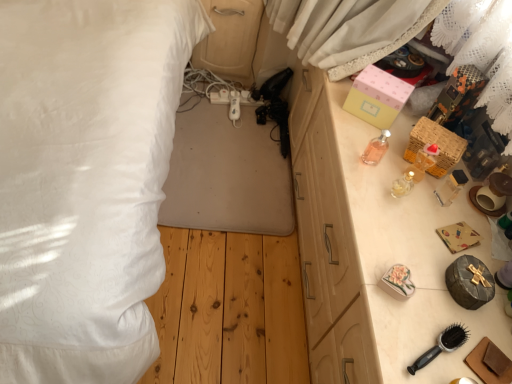
Question: Would you say pink paper box at upper right, which ranks as the 1th box in top-to-bottom order, is outside matte wood dresser at center?

Choices:
 (A) no
 (B) yes

Answer: (B)

Question: From the image's perspective, would you say pink paper box at upper right, which ranks as the 1th box in top-to-bottom order, is positioned over matte wood dresser at center?

Choices:
 (A) no
 (B) yes

Answer: (A)

Question: Does pink paper box at upper right, which is the second box from bottom to top, turn towards matte wood dresser at center?

Choices:
 (A) no
 (B) yes

Answer: (A)

Question: Does pink paper box at upper right, which ranks as the 1th box in top-to-bottom order, have a smaller size compared to matte wood dresser at center?

Choices:
 (A) yes
 (B) no

Answer: (A)

Question: Is pink paper box at upper right, which ranks as the 1th box in top-to-bottom order, facing away from matte wood dresser at center?

Choices:
 (A) no
 (B) yes

Answer: (A)

Question: Is point (462, 362) positioned closer to the camera than point (387, 132)?

Choices:
 (A) farther
 (B) closer

Answer: (B)

Question: Relative to pink glass perfume at upper right, is wooden drawer at right in front or behind?

Choices:
 (A) behind
 (B) front

Answer: (B)

Question: From the image's perspective, is wooden drawer at right positioned above or below pink glass perfume at upper right?

Choices:
 (A) below
 (B) above

Answer: (A)

Question: In terms of size, does wooden drawer at right appear bigger or smaller than pink glass perfume at upper right?

Choices:
 (A) small
 (B) big

Answer: (B)

Question: Visually, is black plastic hairbrush at lower right positioned to the left or to the right of matte wood dresser at center?

Choices:
 (A) left
 (B) right

Answer: (B)

Question: Based on their sizes in the image, would you say black plastic hairbrush at lower right is bigger or smaller than matte wood dresser at center?

Choices:
 (A) small
 (B) big

Answer: (A)

Question: Looking at their shapes, would you say black plastic hairbrush at lower right is wider or thinner than matte wood dresser at center?

Choices:
 (A) wide
 (B) thin

Answer: (B)

Question: From the image's perspective, relative to matte wood dresser at center, is black plastic hairbrush at lower right above or below?

Choices:
 (A) above
 (B) below

Answer: (B)

Question: From the image's perspective, is woven wicker basket at right, marked as the second box in a top-to-bottom arrangement, above or below wooden drawer at right?

Choices:
 (A) below
 (B) above

Answer: (B)

Question: Considering their positions, is woven wicker basket at right, marked as the second box in a top-to-bottom arrangement, located in front of or behind wooden drawer at right?

Choices:
 (A) front
 (B) behind

Answer: (B)